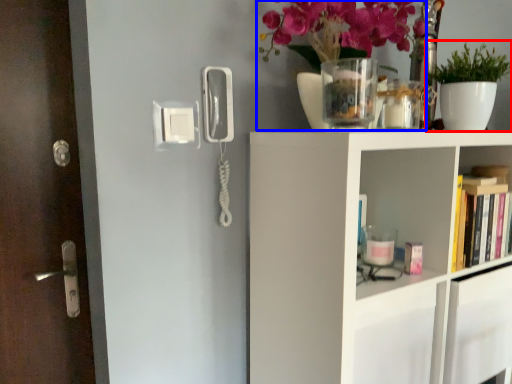
Question: Among these objects, which one is nearest to the camera, houseplant (highlighted by a red box) or floral arrangement (highlighted by a blue box)?

Choices:
 (A) houseplant
 (B) floral arrangement

Answer: (B)